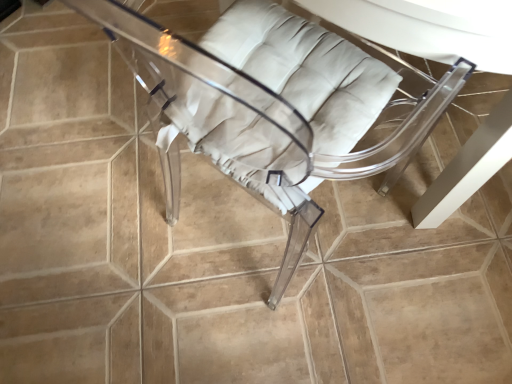
This screenshot has width=512, height=384. Describe the element at coordinates (248, 124) in the screenshot. I see `clear acrylic chair at center` at that location.

I want to click on clear acrylic chair at center, so click(248, 124).

The height and width of the screenshot is (384, 512). I want to click on clear acrylic chair at center, so click(x=248, y=124).